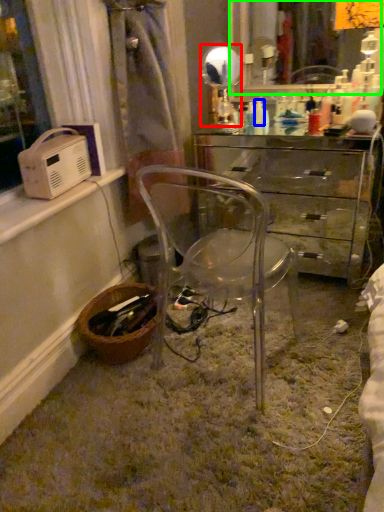
Question: Which object is the closest to the mirror (highlighted by a red box)? Choose among these: toiletry (highlighted by a blue box) or mirror (highlighted by a green box).

Choices:
 (A) toiletry
 (B) mirror

Answer: (A)